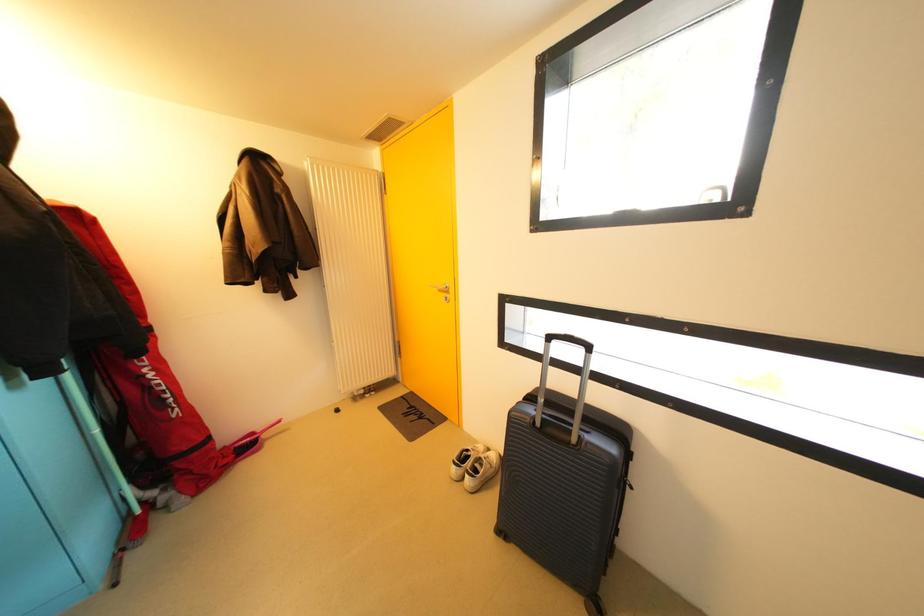
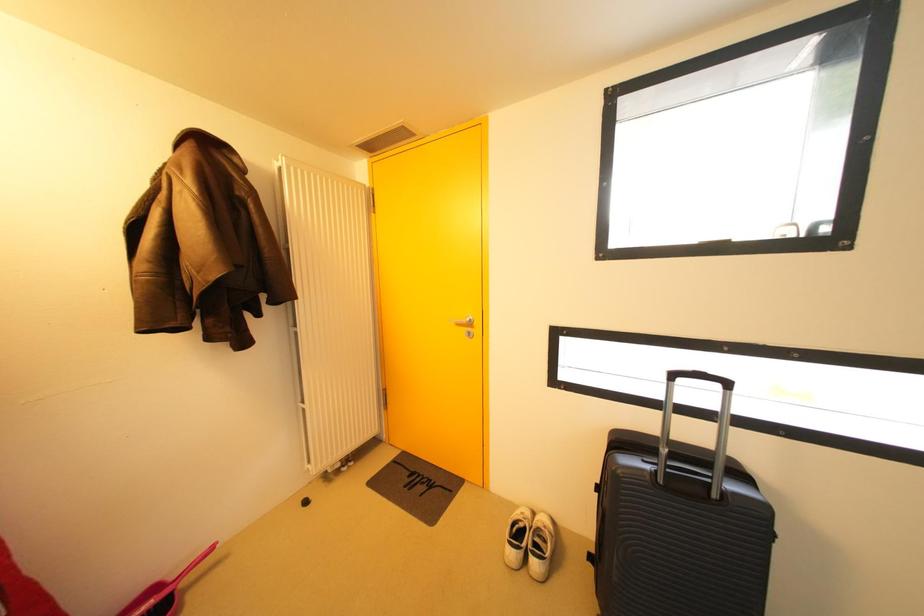
Which direction would the cameraman need to move to produce the second image?

The movement direction of the cameraman is left, forward.